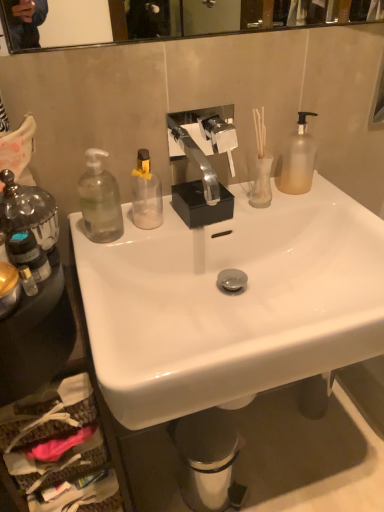
Locate an element on the screen. Image resolution: width=384 pixels, height=512 pixels. free space in front of frosted glass soap dispenser at right, which appears as the fifth bottle when viewed from the left is located at coordinates (313, 203).